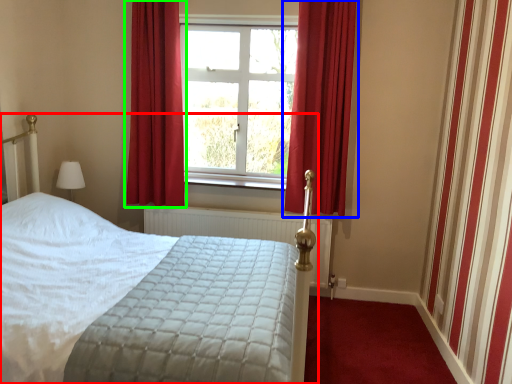
Question: Based on their relative distances, which object is farther from bed (highlighted by a red box)? Choose from curtain (highlighted by a blue box) and curtain (highlighted by a green box).

Choices:
 (A) curtain
 (B) curtain

Answer: (B)